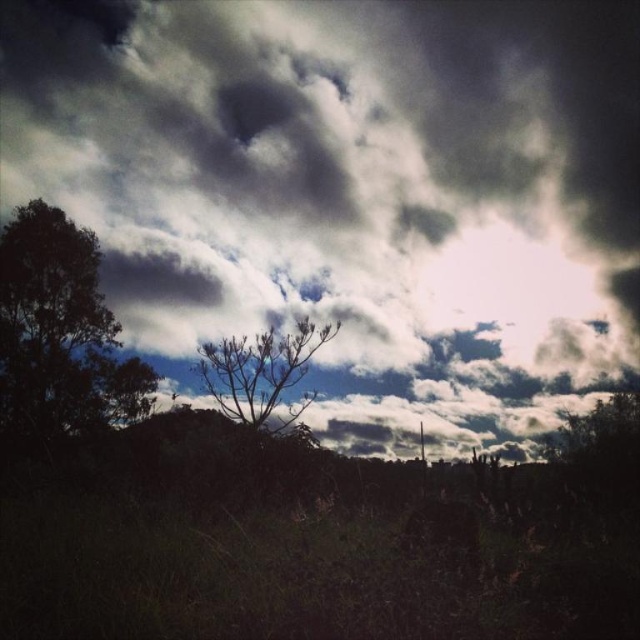
Who is positioned more to the right, dark cloudy sky at upper center or dark green leafy tree at left?

dark cloudy sky at upper center is more to the right.

Is dark cloudy sky at upper center closer to the viewer compared to dark green leafy tree at left?

Yes, it is.

Find the location of a particular element. dark cloudy sky at upper center is located at coordinates (352, 193).

Does dark green leafy tree at left appear under brown textured tree at center?

No, dark green leafy tree at left is not below brown textured tree at center.

Is point (54, 424) positioned after point (198, 365)?

Yes, it is behind point (198, 365).

Locate an element on the screen. This screenshot has width=640, height=640. dark green leafy tree at left is located at coordinates (60, 332).

Does dark cloudy sky at upper center have a greater width compared to brown textured tree at center?

Yes.

Is dark cloudy sky at upper center taller than brown textured tree at center?

Correct, dark cloudy sky at upper center is much taller as brown textured tree at center.

The width and height of the screenshot is (640, 640). What do you see at coordinates (352, 193) in the screenshot?
I see `dark cloudy sky at upper center` at bounding box center [352, 193].

I want to click on dark cloudy sky at upper center, so click(352, 193).